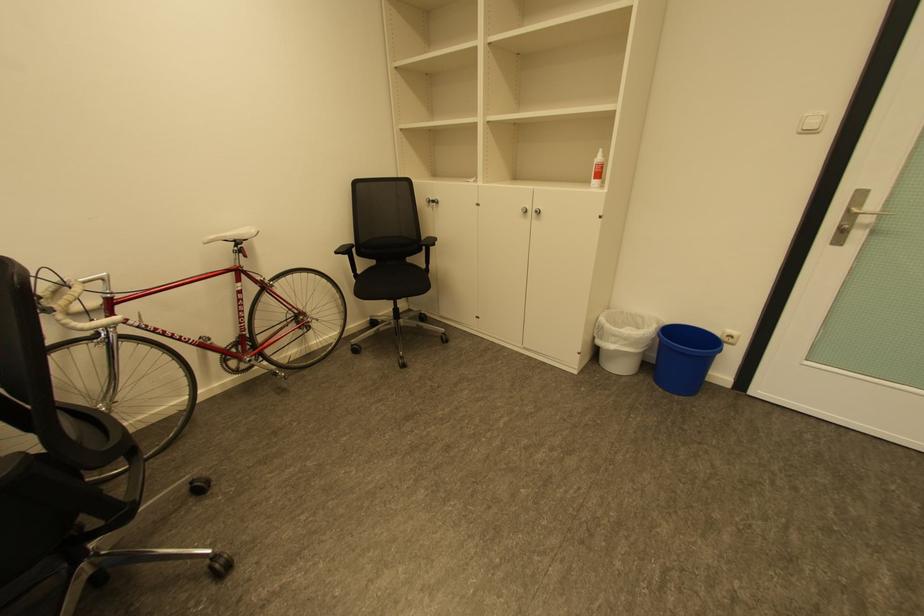
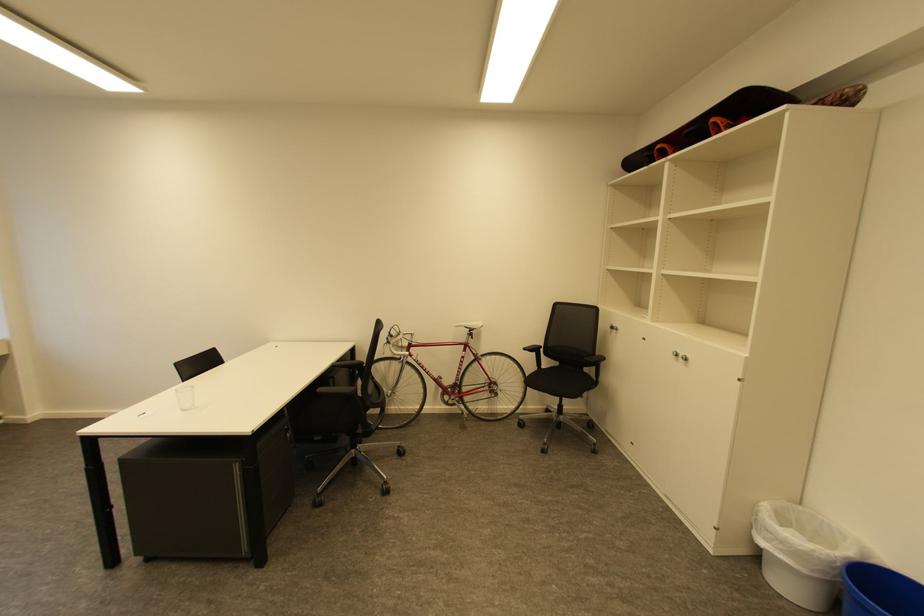
Locate, in the second image, the point that corresponds to pixel 366 272 in the first image.

(551, 368)